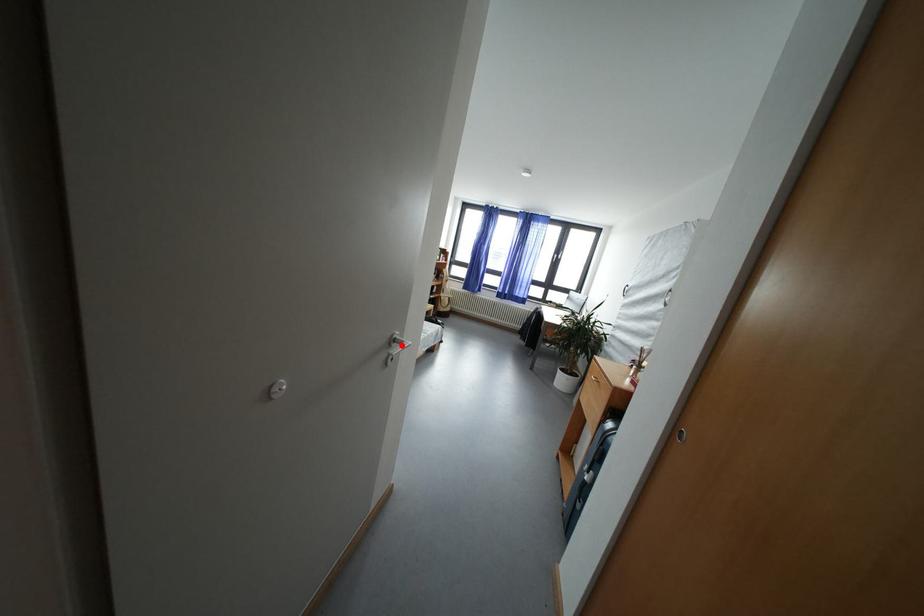
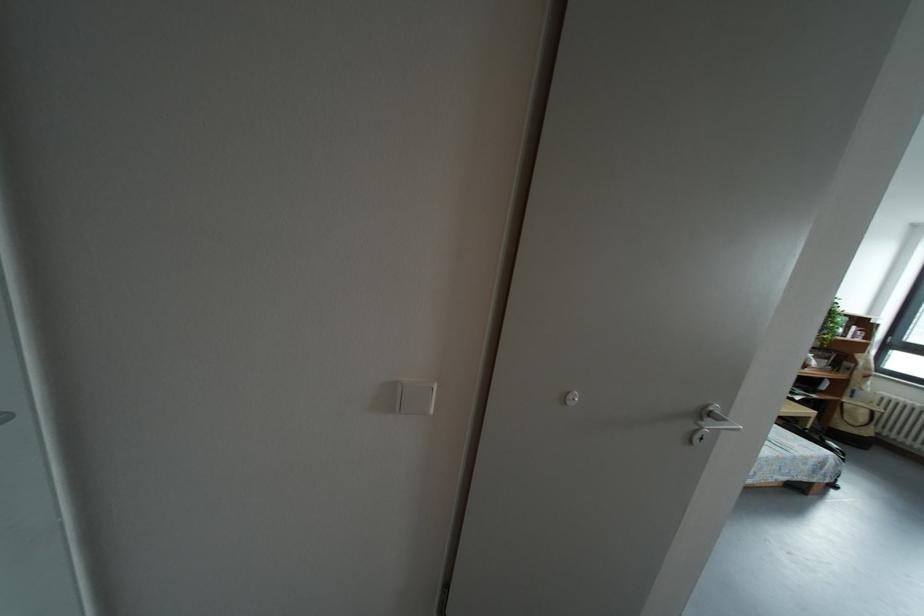
Question: I am providing you with two images of the same scene from different viewpoints. Given a red point in image1, look at the same physical point in image2. Is it:

Choices:
 (A) Closer to the viewpoint
 (B) Farther from the viewpoint

Answer: (B)